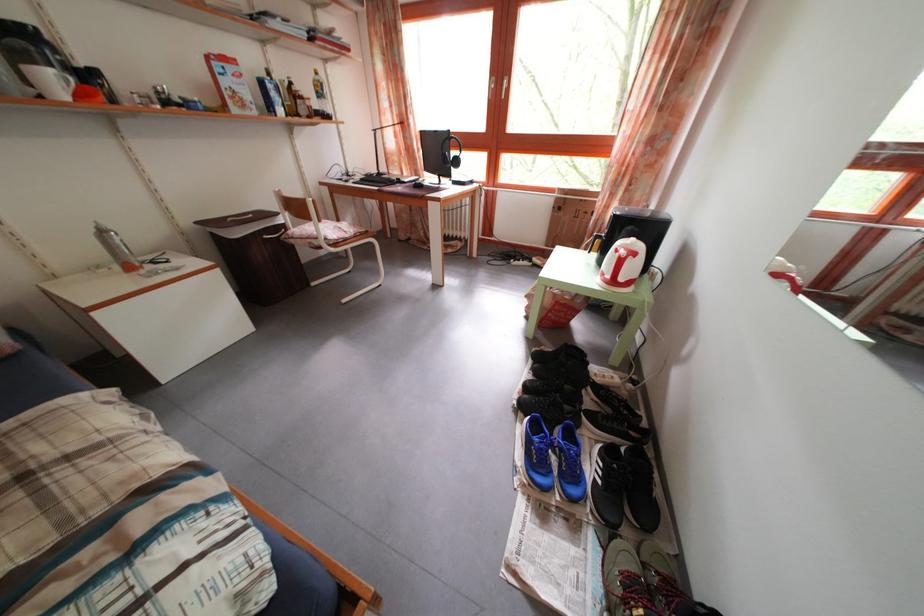
Find where to sit the chair sitting surface. Please return your answer as a coordinate pair (x, y).

(332, 231)